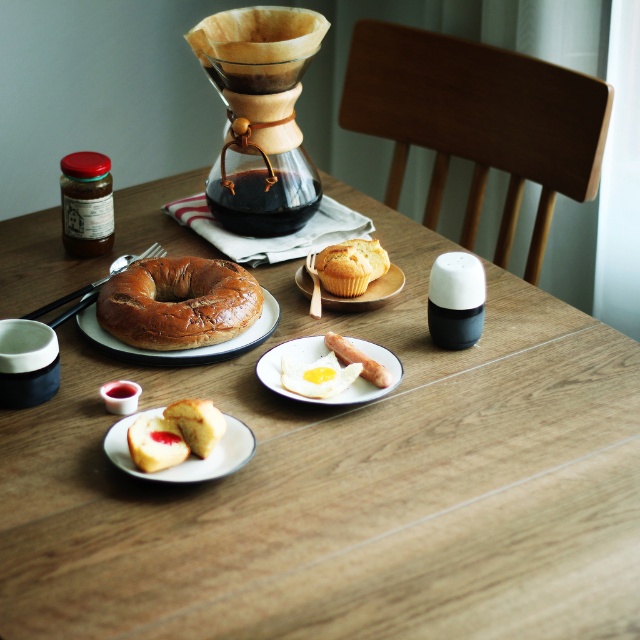
In the scene shown: Which is more to the right, baked golden-brown bagel at center or golden crumbly muffin at center?

golden crumbly muffin at center

From the picture: Does baked golden-brown bagel at center come in front of golden crumbly muffin at center?

Yes.

At what (x,y) coordinates should I click in order to perform the action: click on baked golden-brown bagel at center. Please return your answer as a coordinate pair (x, y). The image size is (640, 640). Looking at the image, I should click on (179, 301).

Does wooden table at center have a greater height compared to smooth white egg at center?

Correct, wooden table at center is much taller as smooth white egg at center.

Can you confirm if wooden table at center is shorter than smooth white egg at center?

In fact, wooden table at center may be taller than smooth white egg at center.

Where is `wooden table at center`? The image size is (640, 640). wooden table at center is located at coordinates (346, 484).

Which is behind, point (449, 387) or point (332, 305)?

The point (332, 305) is more distant.

Is point (372, 573) farther from viewer compared to point (380, 285)?

No, it is not.

What do you see at coordinates (346, 484) in the screenshot? I see `wooden table at center` at bounding box center [346, 484].

Locate an element on the screen. This screenshot has height=640, width=640. wooden table at center is located at coordinates (346, 484).